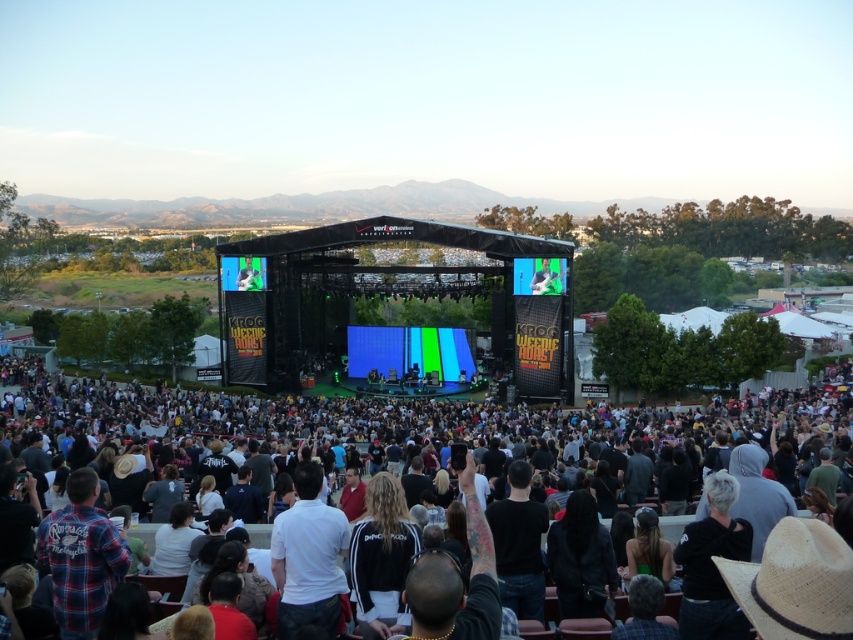
You are at the concert and want to take a photo of the stage without any obstructions. You notice the black adidas jacket at center and the matte green screen at center. Which object should you avoid standing behind to ensure a clear view?

You should avoid standing behind the black adidas jacket at center because it is positioned under the matte green screen at center, meaning the matte green screen at center is above it. Standing behind the black adidas jacket at center might block your view of the stage.

You are a photographer at the concert and want to capture a photo of the black adidas jacket at center. Where should you aim your camera to ensure the jacket is in the frame?

You should aim your camera at the point with coordinates 0.873 on the x axis and 0.448 on the y axis to capture the black adidas jacket at center in the frame.

You are at the concert and want to take a photo of the matte green screen at center without anyone blocking it. Is the black adidas jacket at center in front of it?

Yes, the black adidas jacket at center is closer to the viewer than the matte green screen at center, so it would block the view of the matte green screen at center.